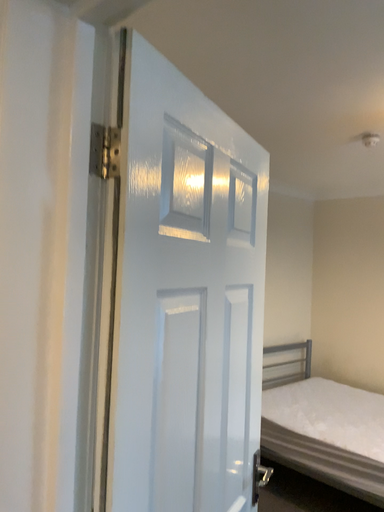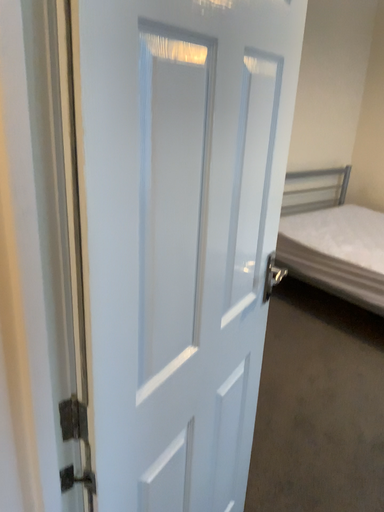
Question: How did the camera likely rotate when shooting the video?

Choices:
 (A) rotated upward
 (B) rotated downward

Answer: (B)